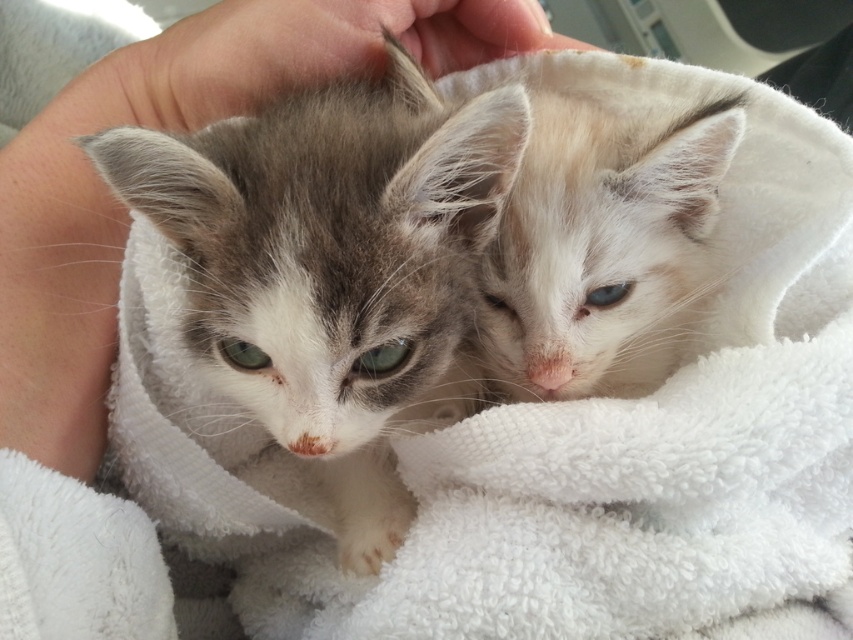
Question: Which point appears closest to the camera in this image?

Choices:
 (A) (364, 332)
 (B) (579, 157)

Answer: (A)

Question: Which point is farther to the camera?

Choices:
 (A) (207, 310)
 (B) (544, 170)

Answer: (B)

Question: Is gray fluffy kitten at center positioned at the back of soft white fur kitten at center?

Choices:
 (A) yes
 (B) no

Answer: (B)

Question: Where is gray fluffy kitten at center located in relation to soft white fur kitten at center in the image?

Choices:
 (A) left
 (B) right

Answer: (A)

Question: Can you confirm if gray fluffy kitten at center is thinner than soft white fur kitten at center?

Choices:
 (A) no
 (B) yes

Answer: (A)